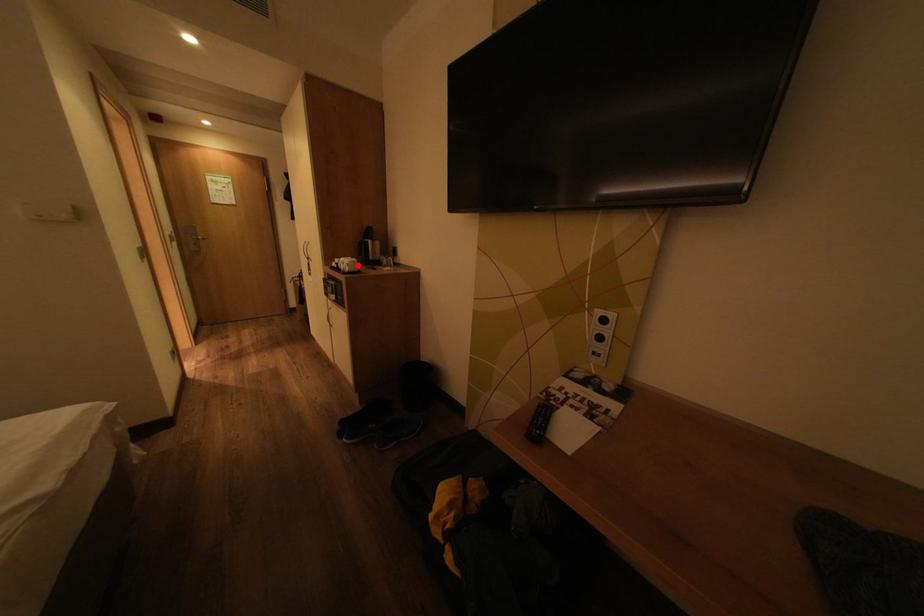
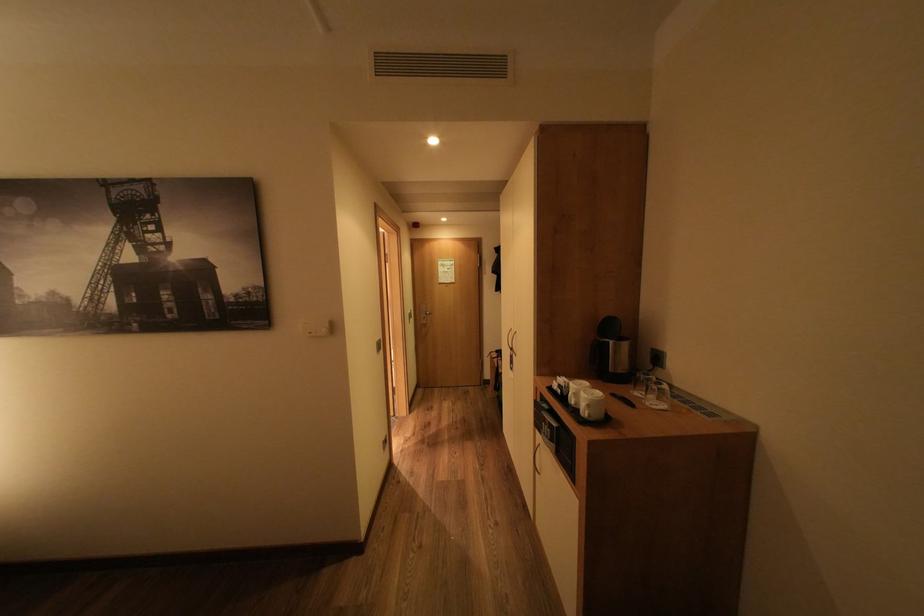
Find the pixel in the second image that matches the highlighted location in the first image.

(600, 406)